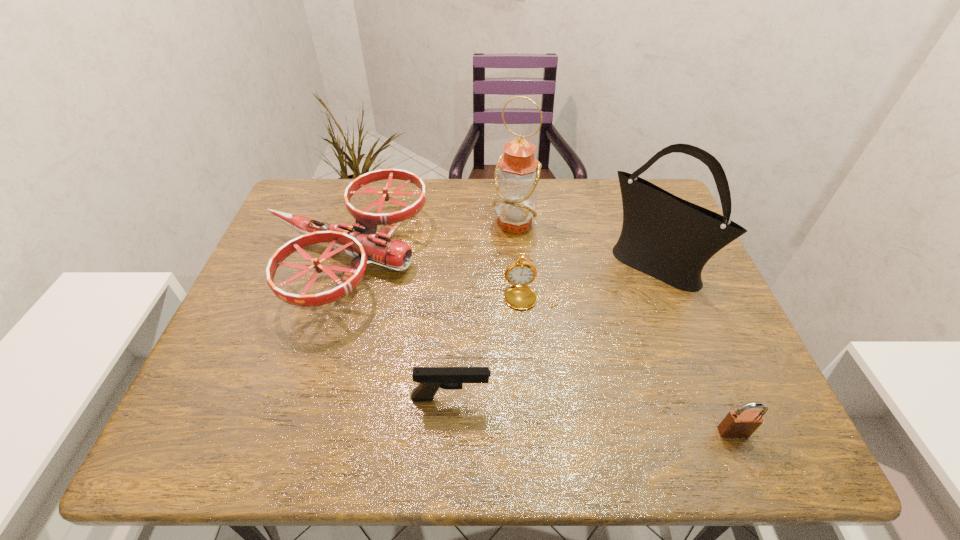
This screenshot has width=960, height=540. Identify the location of oil lamp. coord(517,172).

I want to click on shoulder bag, so click(666, 237).

This screenshot has height=540, width=960. I want to click on drone, so click(x=364, y=244).

What are the coordinates of `pocket watch` in the screenshot? It's located at (519, 273).

Where is `the nearest object`? the nearest object is located at coordinates (741, 423).

Find the location of a particular element. This screenshot has width=960, height=540. the fifth farthest object is located at coordinates (431, 379).

Where is `the fifth object from right to left`? The width and height of the screenshot is (960, 540). the fifth object from right to left is located at coordinates (431, 379).

Identify the location of vacant region located on the front of the oil lamp. (518, 284).

At what (x,y) coordinates should I click in order to perform the action: click on vacant space situated on the back of the shoulder bag. Please return your answer as a coordinate pair (x, y). This screenshot has width=960, height=540. Looking at the image, I should click on (634, 219).

This screenshot has width=960, height=540. I want to click on free space located on the right of the drone, so click(x=548, y=257).